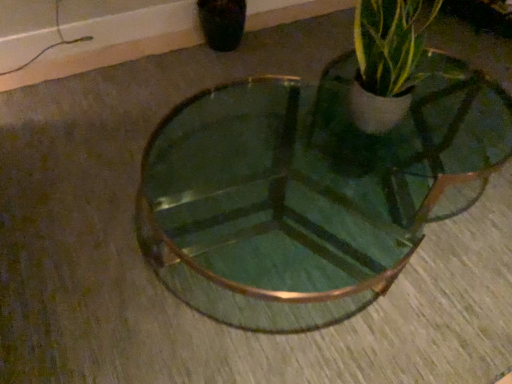
At what (x,y) coordinates should I click in order to perform the action: click on vacant space behind transparent glass table at center. Please return your answer as a coordinate pair (x, y). This screenshot has height=384, width=512. Looking at the image, I should click on (287, 80).